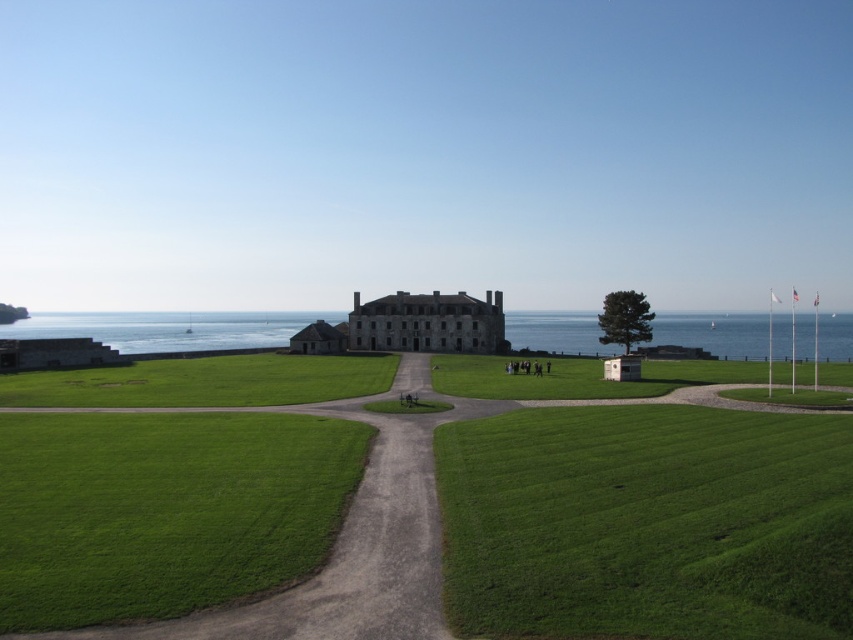
Between green grass at center and blue water at lower left, which one is positioned lower?

green grass at center

Is green grass at center above blue water at lower left?

Incorrect, green grass at center is not positioned above blue water at lower left.

Find the location of a particular element. The width and height of the screenshot is (853, 640). green grass at center is located at coordinates (409, 472).